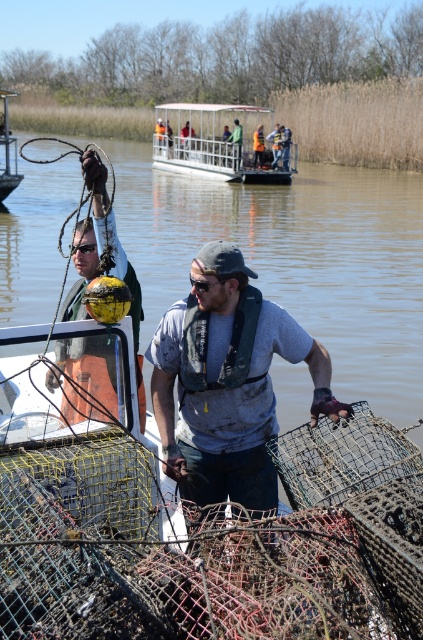
Is yellow rubber buoy at left wider than orange reflective vest at center?

Indeed, yellow rubber buoy at left has a greater width compared to orange reflective vest at center.

Which is behind, point (357, 296) or point (255, 141)?

Point (255, 141)

Where is `yellow rubber buoy at left`? The height and width of the screenshot is (640, 423). yellow rubber buoy at left is located at coordinates (296, 259).

Identify the location of white plastic boat at upper center. Image resolution: width=423 pixels, height=640 pixels. (219, 144).

Does point (214, 134) come farther from viewer compared to point (0, 188)?

Yes, point (214, 134) is behind point (0, 188).

The image size is (423, 640). What do you see at coordinates (219, 144) in the screenshot? I see `white plastic boat at upper center` at bounding box center [219, 144].

Find the location of `white plastic boat at upper center`. white plastic boat at upper center is located at coordinates (219, 144).

Does dirty white shirt at center appear on the right side of metallic yellow buoy at left?

Indeed, dirty white shirt at center is positioned on the right side of metallic yellow buoy at left.

Between dirty white shirt at center and metallic yellow buoy at left, which one appears on the left side from the viewer's perspective?

metallic yellow buoy at left is more to the left.

The width and height of the screenshot is (423, 640). I want to click on dirty white shirt at center, so click(x=227, y=381).

The image size is (423, 640). I want to click on dirty white shirt at center, so click(x=227, y=381).